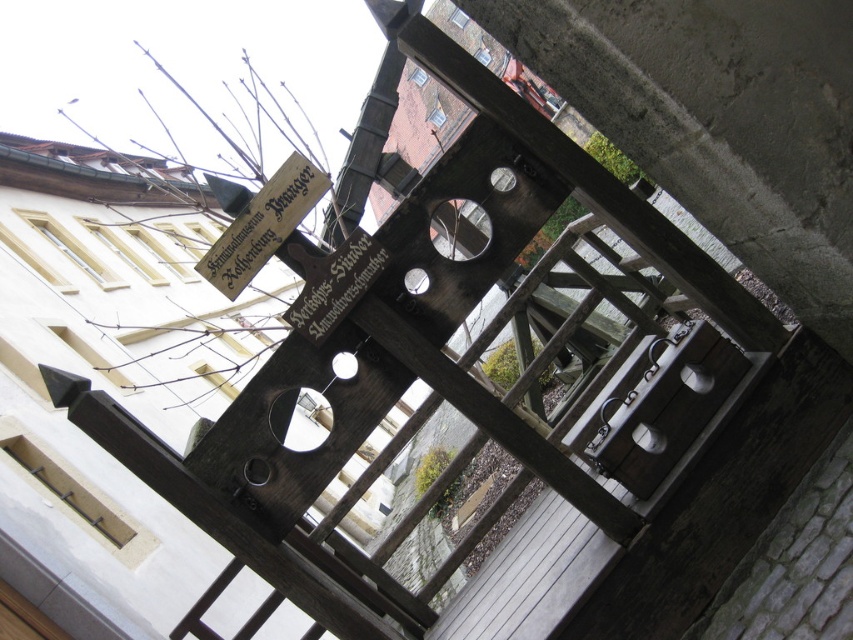
You are a tourist standing in front of the historical wooden structure. You notice two wooden signs. Which wooden sign is closer to you, the wooden sign at upper left or the wooden sign at center?

The wooden sign at upper left is closer to you because it is in front of the wooden sign at center.